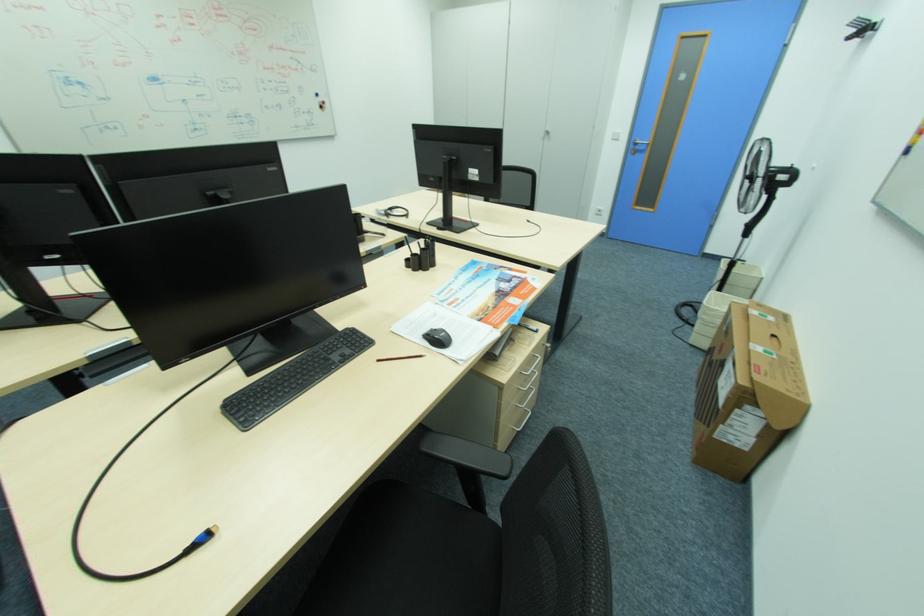
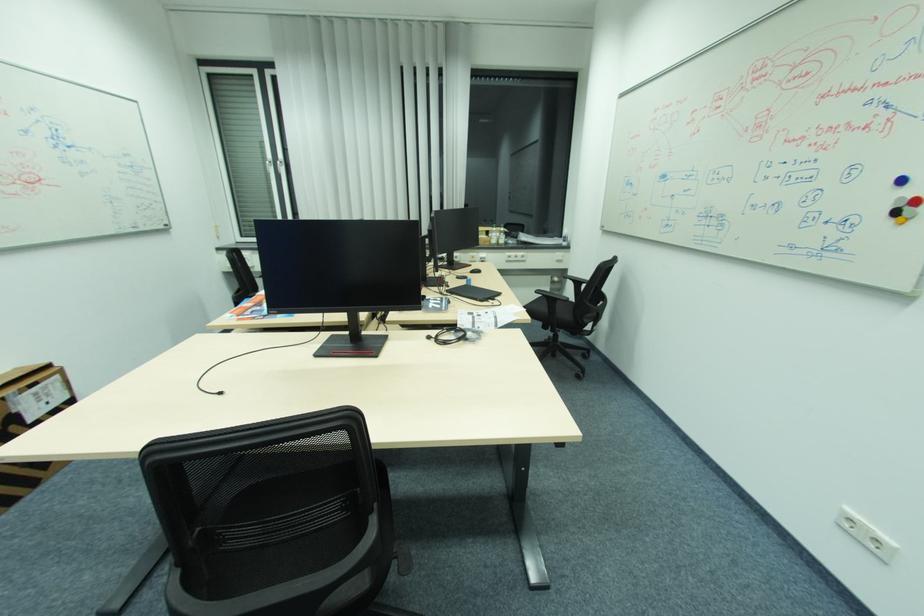
In the second image, find the point that corresponds to pixel 327 111 in the first image.

(896, 221)